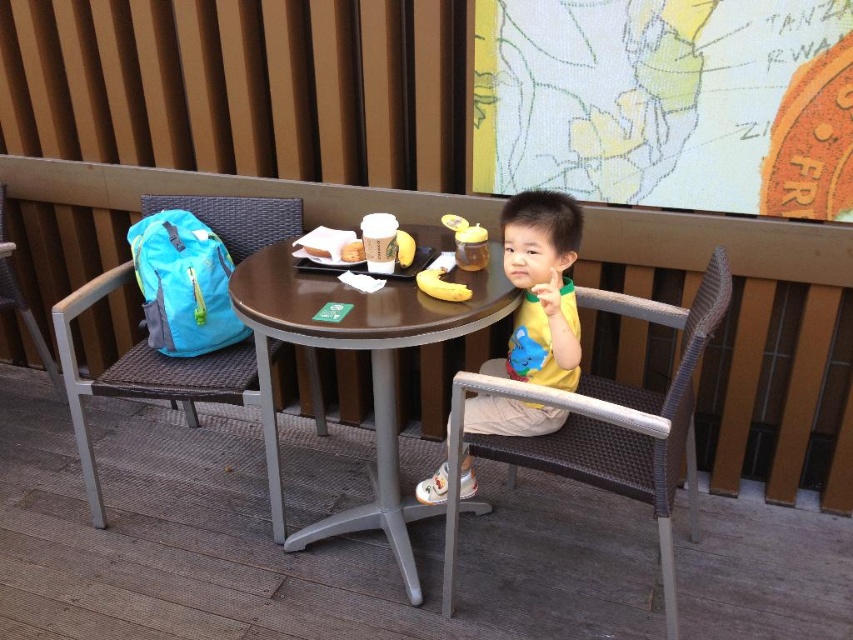
Question: Estimate the real-world distances between objects in this image. Which object is farther from the blue fabric backpack at left?

Choices:
 (A) teal fabric chair at left
 (B) brown woven chair at center

Answer: (B)

Question: In this image, where is brown wooden table at center located relative to teal fabric chair at left?

Choices:
 (A) above
 (B) below

Answer: (B)

Question: Does teal fabric chair at left appear over yellow matte shirt at center?

Choices:
 (A) yes
 (B) no

Answer: (A)

Question: Can you confirm if brown woven chair at center is positioned above yellow matte shirt at center?

Choices:
 (A) no
 (B) yes

Answer: (A)

Question: Which object is positioned farthest from the blue fabric backpack at left?

Choices:
 (A) yellow matte shirt at center
 (B) brown woven chair at center
 (C) brown wooden table at center

Answer: (B)

Question: Estimate the real-world distances between objects in this image. Which object is closer to the brown woven chair at center?

Choices:
 (A) yellow matte banana at center
 (B) blue fabric backpack at left
 (C) brown wooden table at center

Answer: (C)